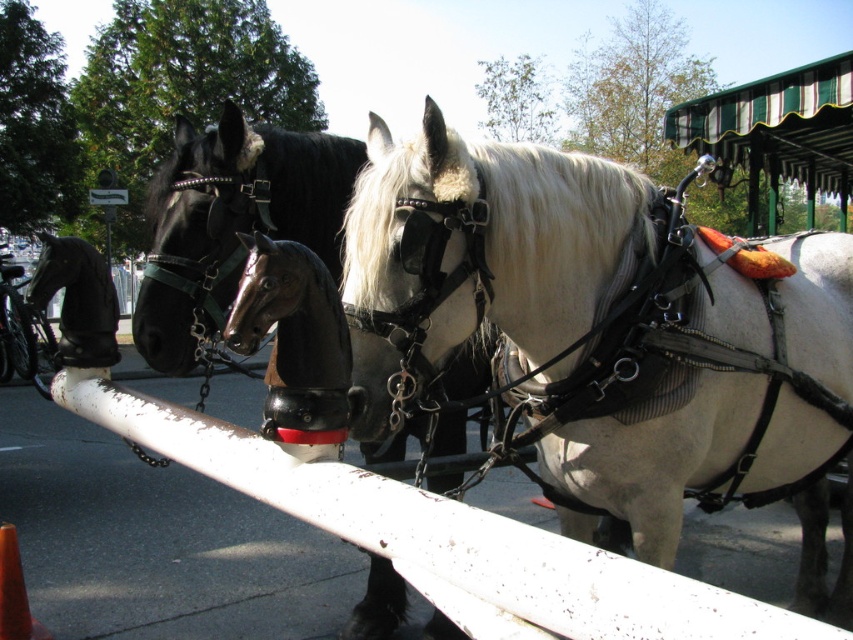
Question: Which of the following is the closest to the observer?

Choices:
 (A) shiny black horse at left
 (B) shiny black horse at center

Answer: (A)

Question: Is white glossy horse at center to the left of shiny black horse at center from the viewer's perspective?

Choices:
 (A) no
 (B) yes

Answer: (A)

Question: Which of these objects is positioned closest to the shiny black horse at center?

Choices:
 (A) shiny black horse at left
 (B) white glossy horse at center

Answer: (A)

Question: Can you confirm if white glossy horse at center is thinner than shiny black horse at left?

Choices:
 (A) no
 (B) yes

Answer: (A)

Question: Which point is farther from the camera taking this photo?

Choices:
 (A) (77, 332)
 (B) (491, 220)

Answer: (A)

Question: Is white glossy horse at center above shiny black horse at left?

Choices:
 (A) yes
 (B) no

Answer: (B)